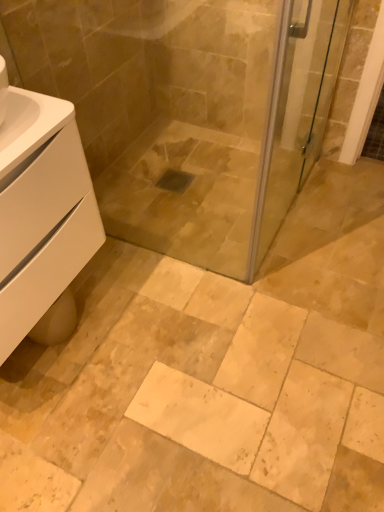
Locate an element on the screen. This screenshot has height=512, width=384. vacant space to the left of transparent glass screen door at upper right is located at coordinates (190, 221).